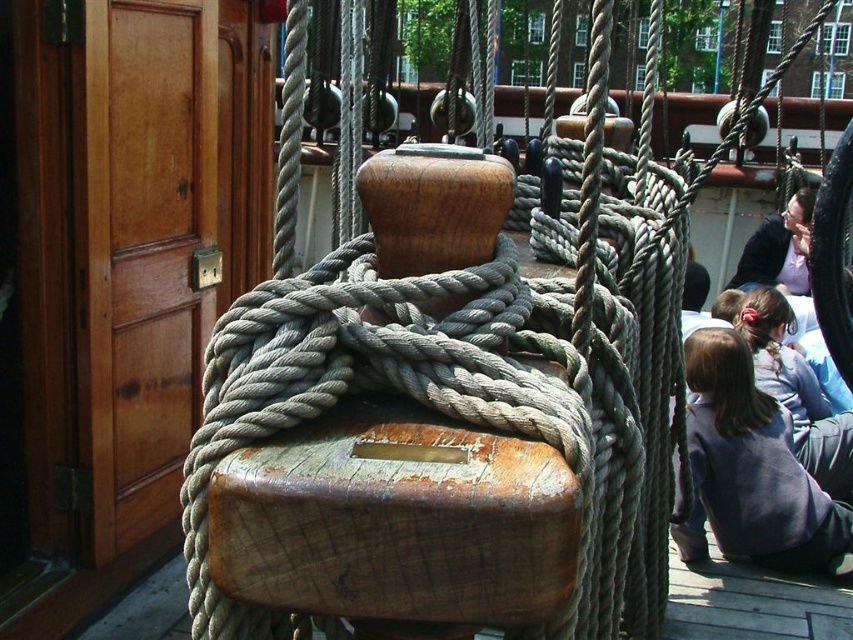
Is dark gray sweatshirt at lower right smaller than dark hair at lower right?

No.

Between dark gray sweatshirt at lower right and dark hair at lower right, which one has more height?

dark gray sweatshirt at lower right

The height and width of the screenshot is (640, 853). What do you see at coordinates (751, 470) in the screenshot?
I see `dark gray sweatshirt at lower right` at bounding box center [751, 470].

Identify the location of dark gray sweatshirt at lower right. (751, 470).

Who is positioned more to the right, light brown hair at lower right or dark hair at lower right?

dark hair at lower right

Between light brown hair at lower right and dark hair at lower right, which one is positioned lower?

light brown hair at lower right

Describe the element at coordinates (796, 392) in the screenshot. Image resolution: width=853 pixels, height=640 pixels. I see `light brown hair at lower right` at that location.

The height and width of the screenshot is (640, 853). In order to click on light brown hair at lower right in this screenshot , I will do `click(796, 392)`.

At what (x,y) coordinates should I click in order to perform the action: click on dark gray sweatshirt at lower right. Please return your answer as a coordinate pair (x, y). This screenshot has width=853, height=640. Looking at the image, I should click on (751, 470).